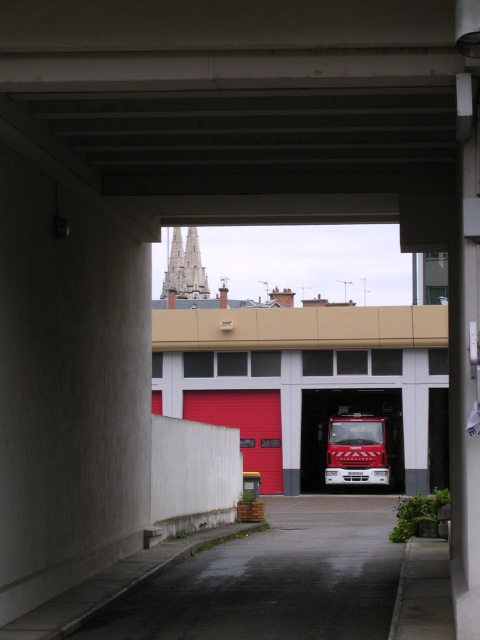
Question: Is red matte fire truck at center further to the viewer compared to beige concrete overpass at center?

Choices:
 (A) yes
 (B) no

Answer: (A)

Question: Can you confirm if red matte fire truck at center is thinner than red metallic fire truck at center?

Choices:
 (A) yes
 (B) no

Answer: (B)

Question: Which object appears closest to the camera in this image?

Choices:
 (A) red matte fire truck at center
 (B) beige concrete overpass at center

Answer: (B)

Question: Which of these objects is positioned farthest from the red metallic fire truck at center?

Choices:
 (A) beige concrete overpass at center
 (B) red matte fire truck at center

Answer: (A)

Question: Based on their relative distances, which object is nearer to the beige concrete overpass at center?

Choices:
 (A) red metallic fire truck at center
 (B) red matte fire truck at center

Answer: (B)

Question: Does beige concrete overpass at center appear over red metallic fire truck at center?

Choices:
 (A) no
 (B) yes

Answer: (B)